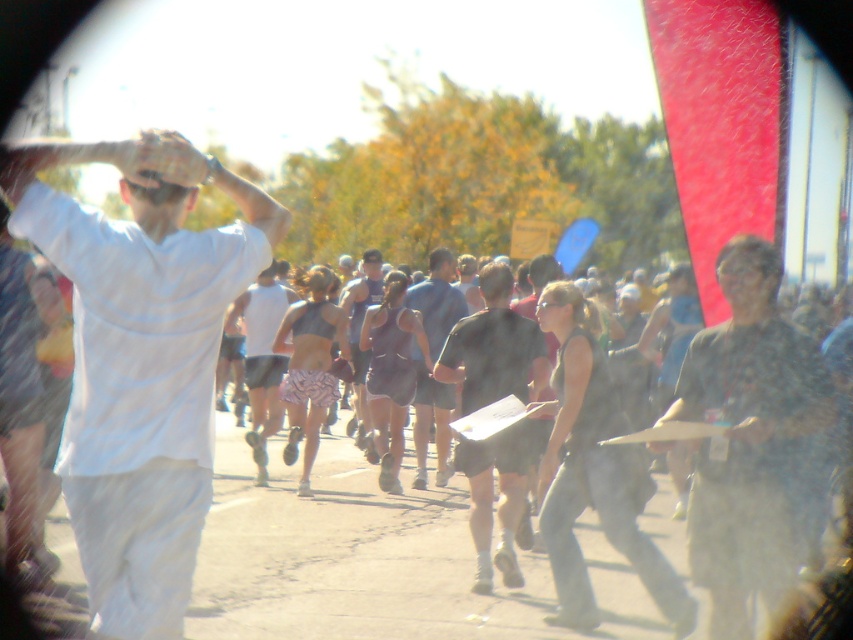
Does white matte shirt at left have a lesser height compared to dark green camouflage shirt at center?

Incorrect, white matte shirt at left's height does not fall short of dark green camouflage shirt at center's.

Does point (93, 300) come closer to viewer compared to point (724, 609)?

Yes, it is in front of point (724, 609).

Is point (218, 168) farther from camera compared to point (699, 413)?

No, (218, 168) is closer to viewer.

This screenshot has width=853, height=640. What are the coordinates of `white matte shirt at left` in the screenshot? It's located at (141, 360).

Looking at this image, can you confirm if gray asphalt pavement at center is positioned to the right of matte gray tank top at center?

Correct, you'll find gray asphalt pavement at center to the right of matte gray tank top at center.

Where is `gray asphalt pavement at center`? The width and height of the screenshot is (853, 640). gray asphalt pavement at center is located at coordinates (347, 557).

Find the location of a particular element. This screenshot has width=853, height=640. gray asphalt pavement at center is located at coordinates (347, 557).

Does point (88, 212) come farther from viewer compared to point (260, 326)?

No, it is in front of (260, 326).

Between white matte shirt at left and matte gray tank top at center, which one appears on the left side from the viewer's perspective?

matte gray tank top at center

Which is behind, point (123, 182) or point (268, 380)?

The point (268, 380) is more distant.

At what (x,y) coordinates should I click in order to perform the action: click on white matte shirt at left. Please return your answer as a coordinate pair (x, y). Looking at the image, I should click on (141, 360).